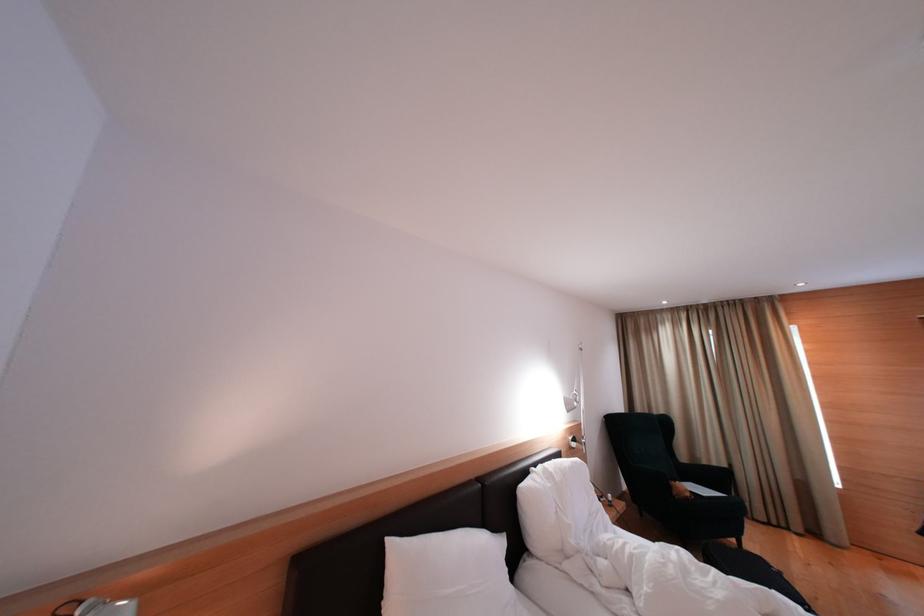
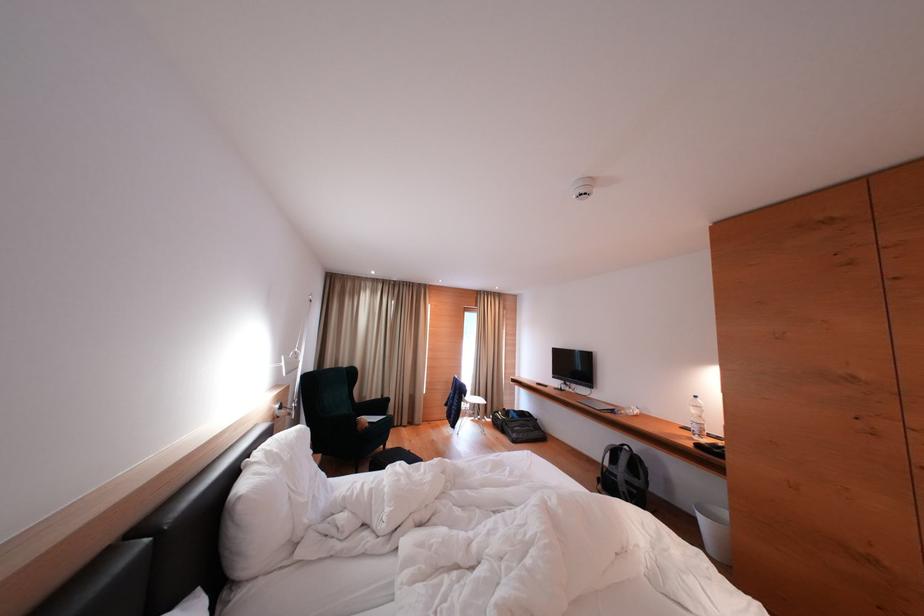
Question: The camera is either moving clockwise (left) or counter-clockwise (right) around the object. The first image is from the beginning of the video and the second image is from the end. Is the camera moving left or right when shooting the video?

Choices:
 (A) Left
 (B) Right

Answer: (A)